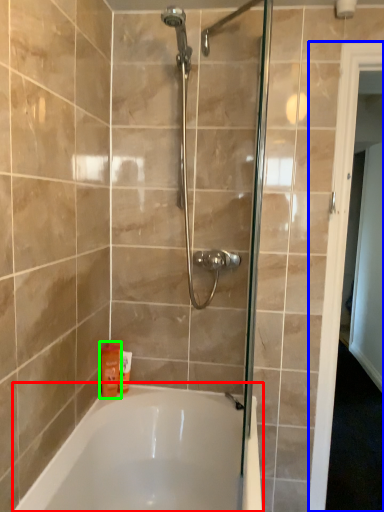
Question: Based on their relative distances, which object is farther from bathtub (highlighted by a red box)? Choose from screen door (highlighted by a blue box) and toiletry (highlighted by a green box).

Choices:
 (A) screen door
 (B) toiletry

Answer: (A)